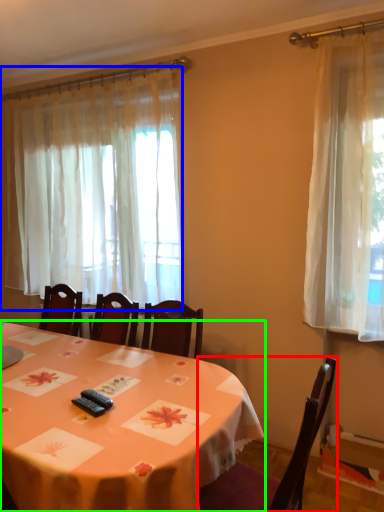
Question: Which object is the closest to the chair (highlighted by a red box)? Choose among these: curtain (highlighted by a blue box) or table (highlighted by a green box).

Choices:
 (A) curtain
 (B) table

Answer: (B)